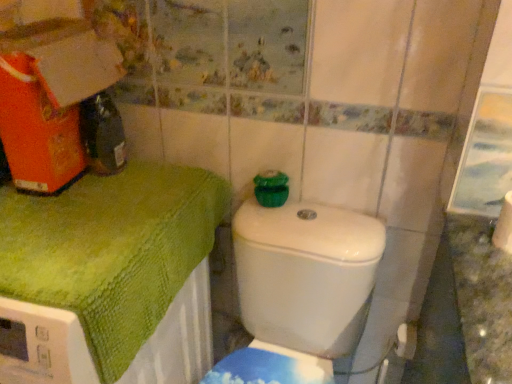
Question: Could you tell me if white matte toilet paper at lower right, the 1th toilet paper from the top, is facing white glossy toilet at center?

Choices:
 (A) no
 (B) yes

Answer: (A)

Question: From the image's perspective, is white matte toilet paper at lower right, the 1th toilet paper from the top, above white glossy toilet at center?

Choices:
 (A) no
 (B) yes

Answer: (B)

Question: Does white matte toilet paper at lower right, the 1th toilet paper positioned from the front, have a lesser width compared to white glossy toilet at center?

Choices:
 (A) yes
 (B) no

Answer: (A)

Question: Is white matte toilet paper at lower right, the 1th toilet paper positioned from the front, not within white glossy toilet at center?

Choices:
 (A) no
 (B) yes

Answer: (B)

Question: Is white matte toilet paper at lower right, the second toilet paper from the back, facing away from white glossy toilet at center?

Choices:
 (A) no
 (B) yes

Answer: (A)

Question: Does white matte toilet paper at lower right, the 1th toilet paper positioned from the front, lie behind white glossy toilet at center?

Choices:
 (A) no
 (B) yes

Answer: (B)

Question: Is the surface of green textured towel at upper left in direct contact with white glossy toilet at center?

Choices:
 (A) no
 (B) yes

Answer: (A)

Question: Is white glossy toilet at center located within green textured towel at upper left?

Choices:
 (A) no
 (B) yes

Answer: (A)

Question: Does green textured towel at upper left have a lesser height compared to white glossy toilet at center?

Choices:
 (A) yes
 (B) no

Answer: (B)

Question: From the image's perspective, does green textured towel at upper left appear lower than white glossy toilet at center?

Choices:
 (A) no
 (B) yes

Answer: (A)

Question: Does green textured towel at upper left turn towards white glossy toilet at center?

Choices:
 (A) no
 (B) yes

Answer: (A)

Question: Is green textured towel at upper left further to camera compared to white glossy toilet at center?

Choices:
 (A) yes
 (B) no

Answer: (A)

Question: Can you confirm if green textured towel at upper left is bigger than white matte toilet paper at lower right, placed as the 1th toilet paper when sorted from bottom to top?

Choices:
 (A) no
 (B) yes

Answer: (B)